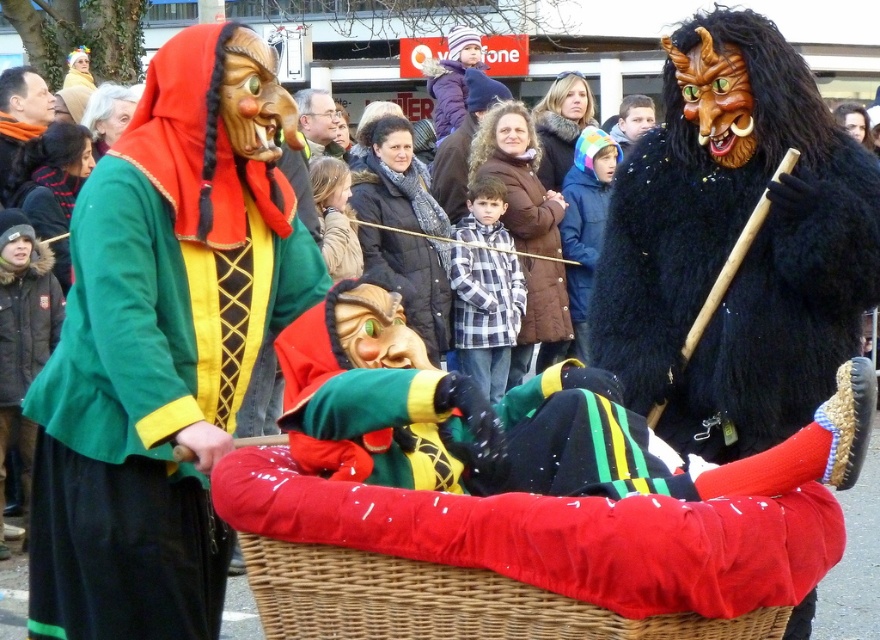
Does point (312, 97) lie behind point (617, 129)?

No, (312, 97) is in front of (617, 129).

Can you confirm if glossy plastic glasses at center is positioned to the left of smooth brown leather jacket at upper center?

Indeed, glossy plastic glasses at center is positioned on the left side of smooth brown leather jacket at upper center.

Find the location of a particular element. The height and width of the screenshot is (640, 880). glossy plastic glasses at center is located at coordinates [x=318, y=122].

The width and height of the screenshot is (880, 640). I want to click on glossy plastic glasses at center, so click(318, 122).

Consider the image. Is woven wicker basket at center further to camera compared to smooth brown leather jacket at upper center?

No, it is in front of smooth brown leather jacket at upper center.

Which is more to the left, woven wicker basket at center or smooth brown leather jacket at upper center?

woven wicker basket at center is more to the left.

The height and width of the screenshot is (640, 880). In order to click on woven wicker basket at center in this screenshot , I will do `click(428, 588)`.

What are the coordinates of `woven wicker basket at center` in the screenshot? It's located at (428, 588).

Who is shorter, green velvet mask at left or smooth brown leather jacket at upper center?

Standing shorter between the two is smooth brown leather jacket at upper center.

Consider the image. Is green velvet mask at left in front of smooth brown leather jacket at upper center?

Yes, it is.

Which is in front, point (150, 77) or point (638, 122)?

Point (150, 77) is in front.

Find the location of `green velvet mask at left`. green velvet mask at left is located at coordinates (163, 342).